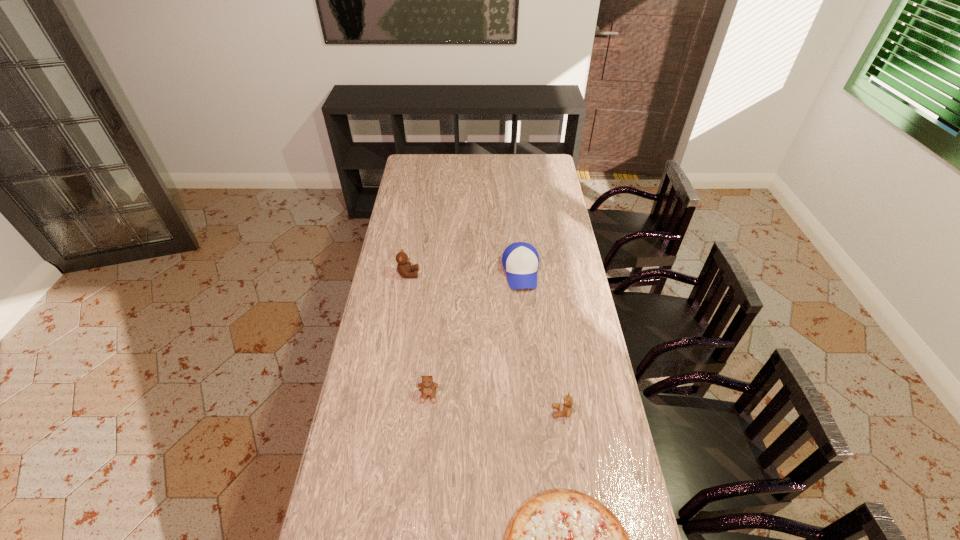
Where is `the leftmost object`? the leftmost object is located at coordinates (404, 268).

I want to click on the tallest teddy bear, so click(404, 268).

Where is `baseball cap`? The image size is (960, 540). baseball cap is located at coordinates (520, 260).

The image size is (960, 540). Find the location of `the fourth object from right to left`. the fourth object from right to left is located at coordinates (428, 388).

The image size is (960, 540). Identify the location of the rightmost teddy bear. (565, 407).

Identify the location of free space located on the face of the leftmost object. The width and height of the screenshot is (960, 540). (442, 274).

I want to click on free space located on the front-facing side of the baseball cap, so click(527, 336).

The image size is (960, 540). I want to click on vacant area situated on the front-facing side of the second object from left to right, so click(x=424, y=440).

Find the location of a particular element. This screenshot has width=960, height=540. free spot located 0.320m on the front-facing side of the rightmost teddy bear is located at coordinates (454, 411).

This screenshot has width=960, height=540. I want to click on vacant space positioned on the front-facing side of the rightmost teddy bear, so click(509, 411).